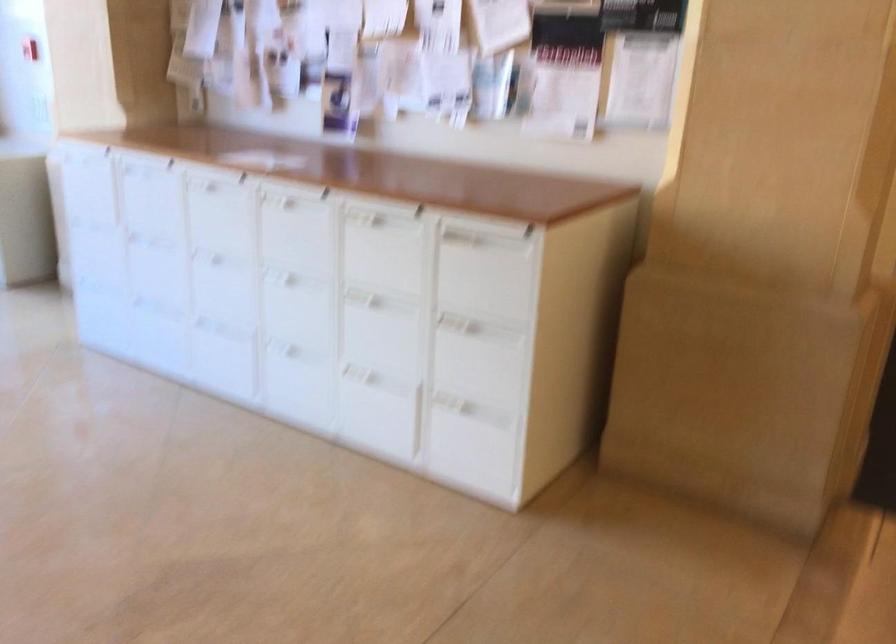
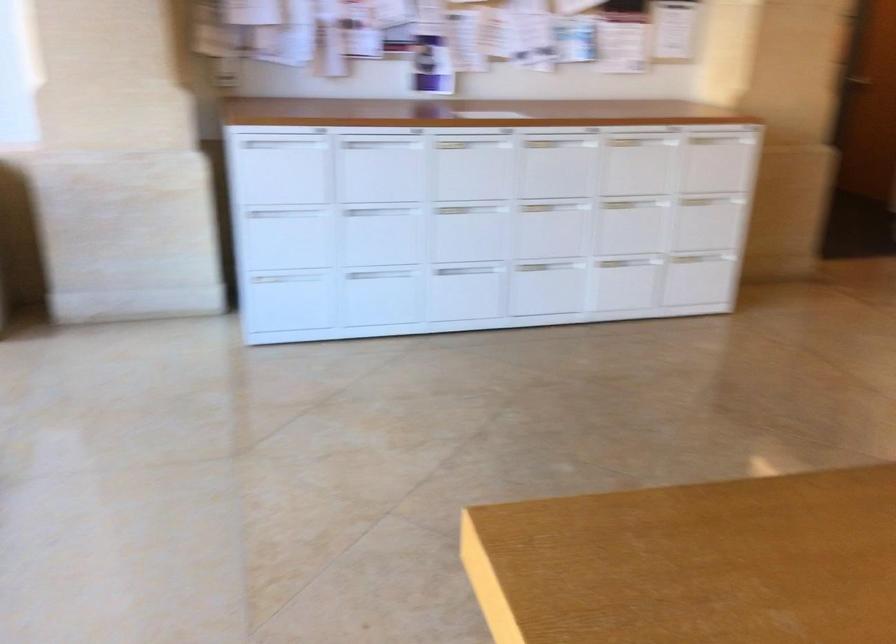
Where in the second image is the point corresponding to the point at 307,238 from the first image?

(556, 163)